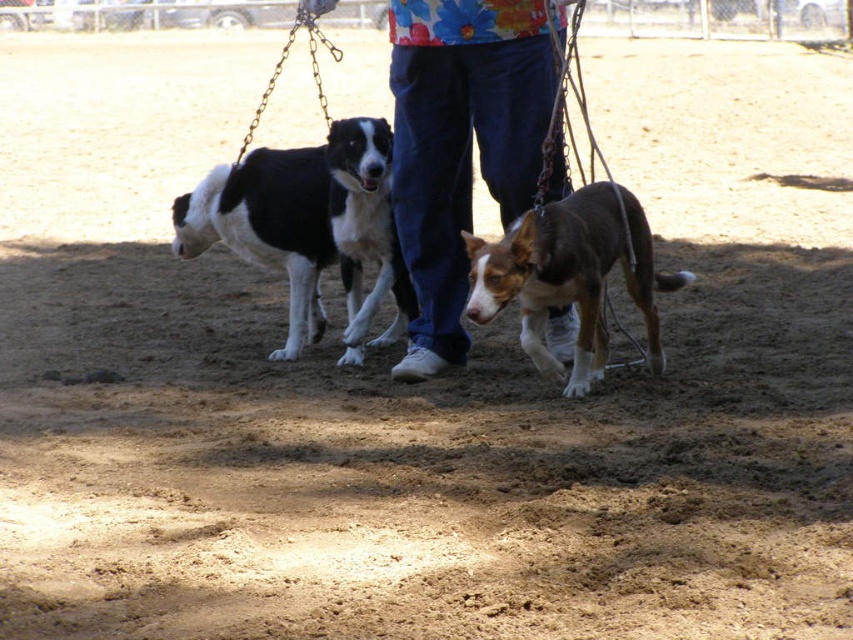
You are a photographer trying to capture a clear shot of the blue jeans at center and the black and white fur at left. Since you want both subjects in focus, which one should you adjust your camera focus on first considering their positions?

The blue jeans at center is closer to the viewer than the black and white fur at left, so you should focus on the blue jeans at center first to ensure both are in focus.

You are a photographer trying to capture a photo of the blue jeans at center and the black and white fur at left. Based on their heights, which one should you focus on first if you want to ensure both are in focus?

The blue jeans at center is much taller than the black and white fur at left, so you should focus on the blue jeans at center first to ensure both are in focus.

Based on the scene description, where is the blue jeans at center located in the image?

The blue jeans at center is located at point (460, 145).